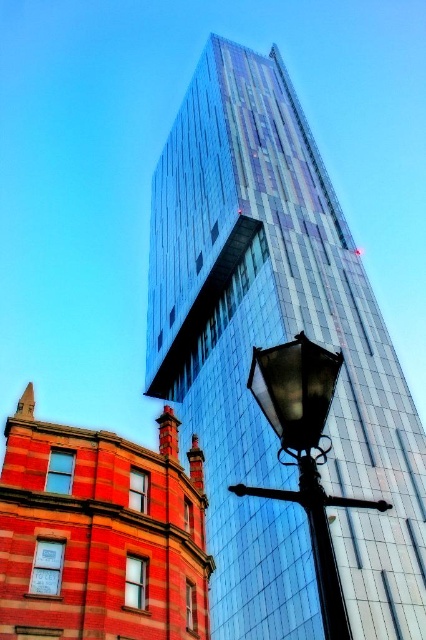
Question: Can you confirm if shiny glass skyscraper at center is thinner than black glass street light at lower right?

Choices:
 (A) no
 (B) yes

Answer: (A)

Question: Is shiny glass skyscraper at center to the left of black glass street light at lower right from the viewer's perspective?

Choices:
 (A) no
 (B) yes

Answer: (B)

Question: Does shiny glass skyscraper at center have a larger size compared to black glass street light at lower right?

Choices:
 (A) yes
 (B) no

Answer: (A)